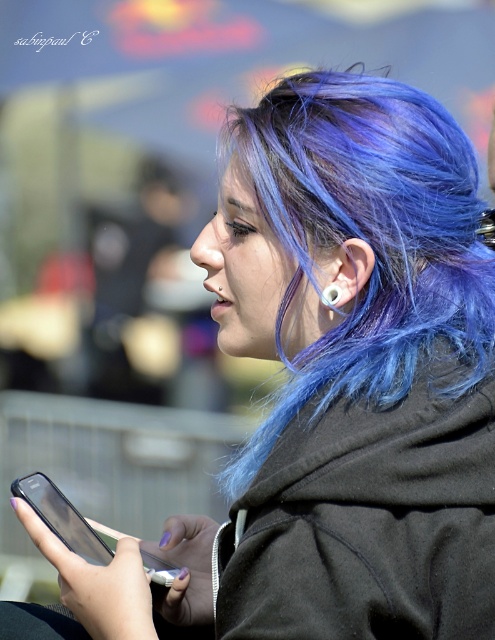
Question: Does blue dyed hair at center appear under silver metallic earring at ear?

Choices:
 (A) yes
 (B) no

Answer: (B)

Question: Is blue dyed hair at center further to the viewer compared to silver metallic earring at ear?

Choices:
 (A) yes
 (B) no

Answer: (B)

Question: Which object appears farthest from the camera in this image?

Choices:
 (A) silver metallic earring at ear
 (B) blue dyed hair at center

Answer: (A)

Question: Among these objects, which one is nearest to the camera?

Choices:
 (A) silver metallic earring at ear
 (B) blue dyed hair at center

Answer: (B)

Question: Does blue dyed hair at center appear over silver metallic earring at ear?

Choices:
 (A) yes
 (B) no

Answer: (A)